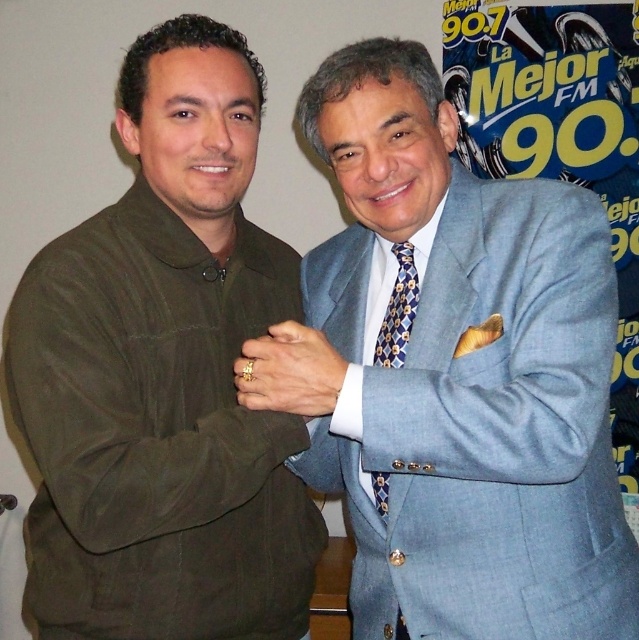
Between matte gray suit at center and matte olive-green jacket at left, which one is positioned higher?

Positioned higher is matte olive-green jacket at left.

Based on the photo, can you confirm if matte gray suit at center is smaller than matte olive-green jacket at left?

Incorrect, matte gray suit at center is not smaller in size than matte olive-green jacket at left.

The image size is (639, 640). What are the coordinates of `matte gray suit at center` in the screenshot? It's located at (452, 372).

Where is `matte gray suit at center`? matte gray suit at center is located at coordinates (452, 372).

Between matte gray suit at center and blue patterned tie at center, which one appears on the right side from the viewer's perspective?

matte gray suit at center is more to the right.

Where is `matte gray suit at center`? Image resolution: width=639 pixels, height=640 pixels. matte gray suit at center is located at coordinates 452,372.

Is point (596, 476) behind point (417, 280)?

No, (596, 476) is closer to viewer.

At what (x,y) coordinates should I click in order to perform the action: click on matte gray suit at center. Please return your answer as a coordinate pair (x, y). Looking at the image, I should click on (452, 372).

Between matte olive-green jacket at left and blue patterned tie at center, which one has more height?

matte olive-green jacket at left is taller.

From the picture: Can you confirm if matte olive-green jacket at left is positioned above blue patterned tie at center?

Correct, matte olive-green jacket at left is located above blue patterned tie at center.

Is point (174, 253) farther from viewer compared to point (412, 284)?

That is False.

Identify the location of matte olive-green jacket at left. (164, 376).